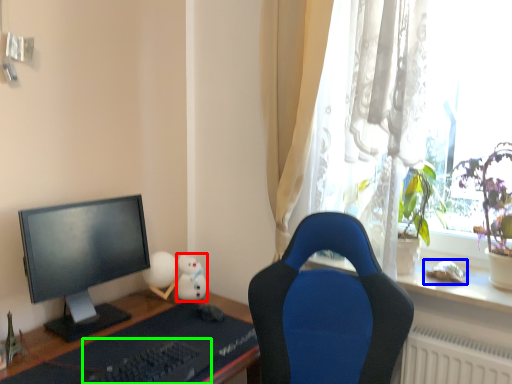
Question: Which object is positioned closest to toy (highlighted by a red box)? Select from toy (highlighted by a blue box) and keyboard (highlighted by a green box).

Choices:
 (A) toy
 (B) keyboard

Answer: (B)